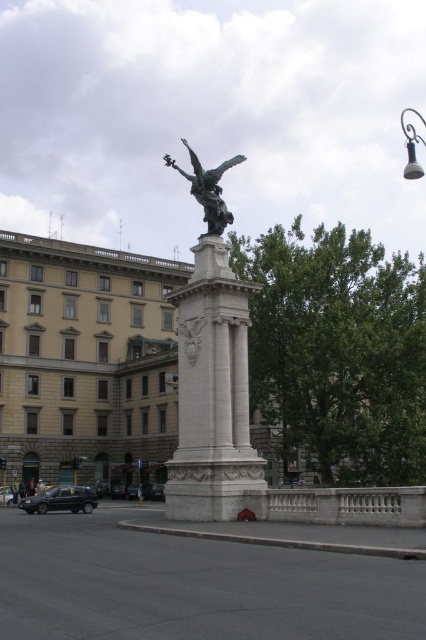
Question: Is shiny black car at lower left further to camera compared to shiny silver car at lower left?

Choices:
 (A) yes
 (B) no

Answer: (B)

Question: Which point is farther from the camera taking this photo?

Choices:
 (A) (54, 508)
 (B) (190, 152)
 (C) (236, 458)

Answer: (A)

Question: Based on their relative distances, which object is nearer to the green patina statue at upper center?

Choices:
 (A) shiny black car at lower left
 (B) metallic at upper right
 (C) metallic silver car at lower left
 (D) bronze statue at center

Answer: (D)

Question: Can you confirm if bronze statue at center is positioned above green patina statue at upper center?

Choices:
 (A) no
 (B) yes

Answer: (A)

Question: Is bronze statue at center bigger than shiny silver car at lower left?

Choices:
 (A) yes
 (B) no

Answer: (A)

Question: Which of the following is the farthest from the observer?

Choices:
 (A) shiny silver car at lower left
 (B) shiny black car at lower left
 (C) green patina statue at upper center

Answer: (A)